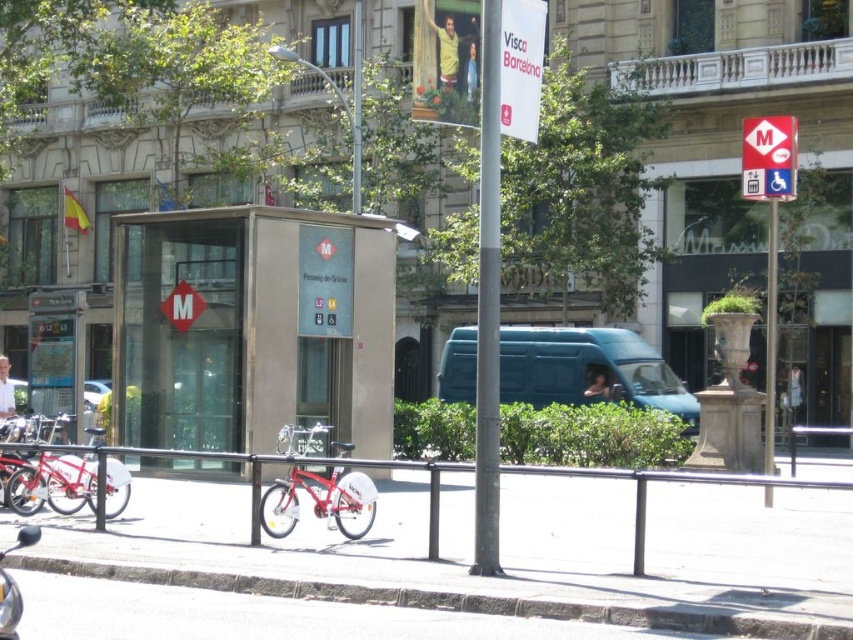
Who is positioned more to the left, white cotton shirt at lower left or smooth skin face at center?

white cotton shirt at lower left is more to the left.

Does white cotton shirt at lower left have a larger size compared to smooth skin face at center?

Indeed, white cotton shirt at lower left has a larger size compared to smooth skin face at center.

This screenshot has width=853, height=640. Find the location of `white cotton shirt at lower left`. white cotton shirt at lower left is located at coordinates (4, 392).

Image resolution: width=853 pixels, height=640 pixels. What do you see at coordinates (320, 500) in the screenshot?
I see `shiny red bicycle at center` at bounding box center [320, 500].

Who is more forward, (323, 513) or (91, 408)?

Point (323, 513)

Who is more forward, (260, 520) or (86, 396)?

Point (260, 520) is more forward.

You are a GUI agent. You are given a task and a screenshot of the screen. Output one action in this format:
    pyautogui.click(x=<x>, y=<y>)
    Task: Click on the shiny red bicycle at center
    This screenshot has width=853, height=640.
    Given the screenshot: What is the action you would take?
    pyautogui.click(x=320, y=500)

Which is more to the right, metallic red bicycle at left or metallic silver car at center?

metallic red bicycle at left is more to the right.

Is point (48, 474) behind point (90, 408)?

No.

Who is more forward, (94, 488) or (103, 401)?

Point (94, 488) is more forward.

This screenshot has width=853, height=640. Identify the location of metallic red bicycle at left. (53, 484).